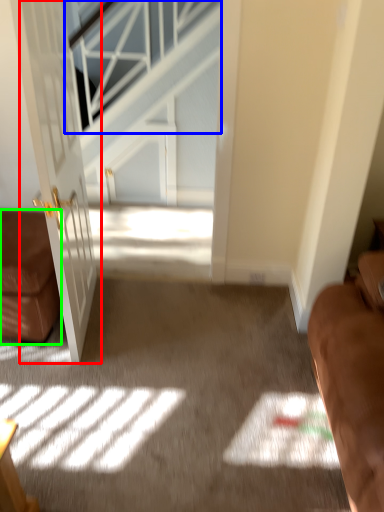
Question: Which is nearer to the door (highlighted by a red box)? window (highlighted by a blue box) or furniture (highlighted by a green box).

Choices:
 (A) window
 (B) furniture

Answer: (B)